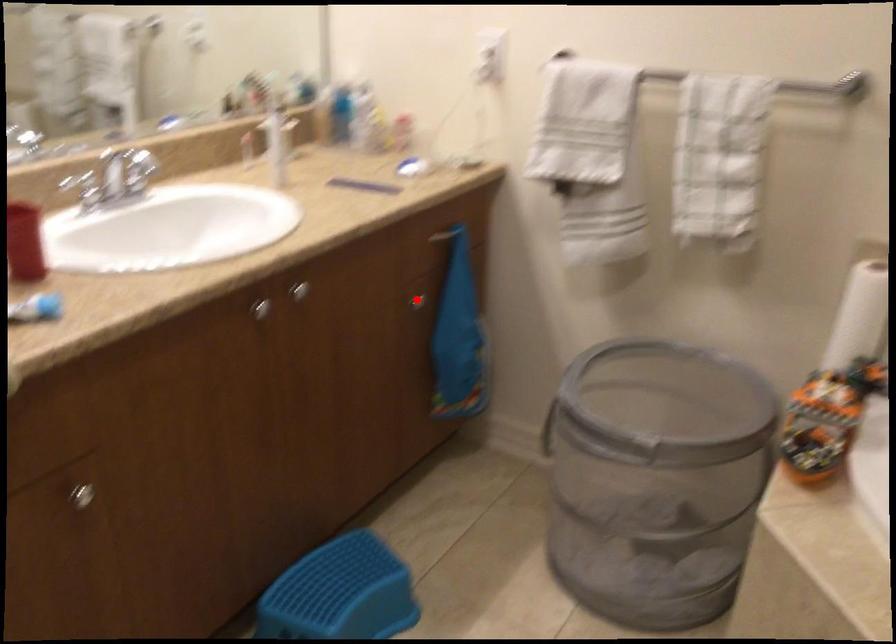
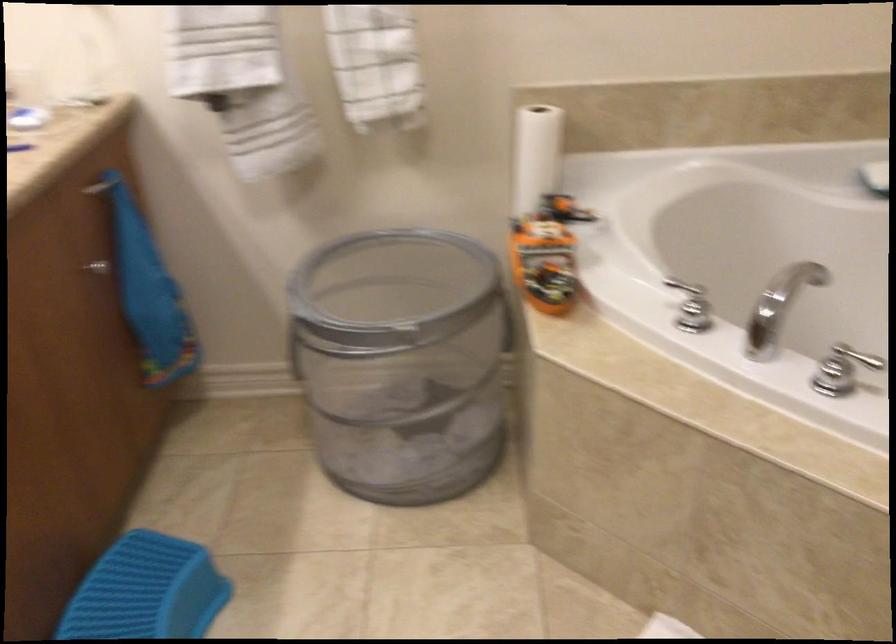
Question: I am providing you with two images of the same scene from different viewpoints. Given a red point in image1, look at the same physical point in image2. Is it:

Choices:
 (A) Closer to the viewpoint
 (B) Farther from the viewpoint

Answer: (A)